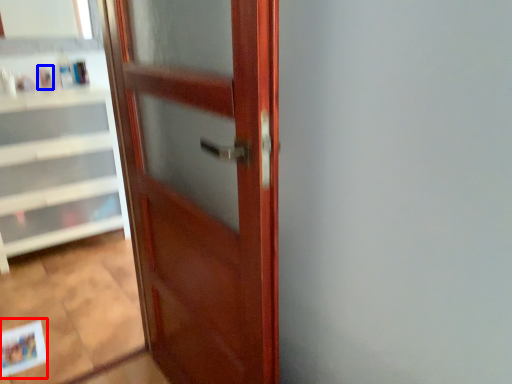
Question: Which object appears farthest to the camera in this image, postcard (highlighted by a red box) or toiletry (highlighted by a blue box)?

Choices:
 (A) postcard
 (B) toiletry

Answer: (B)